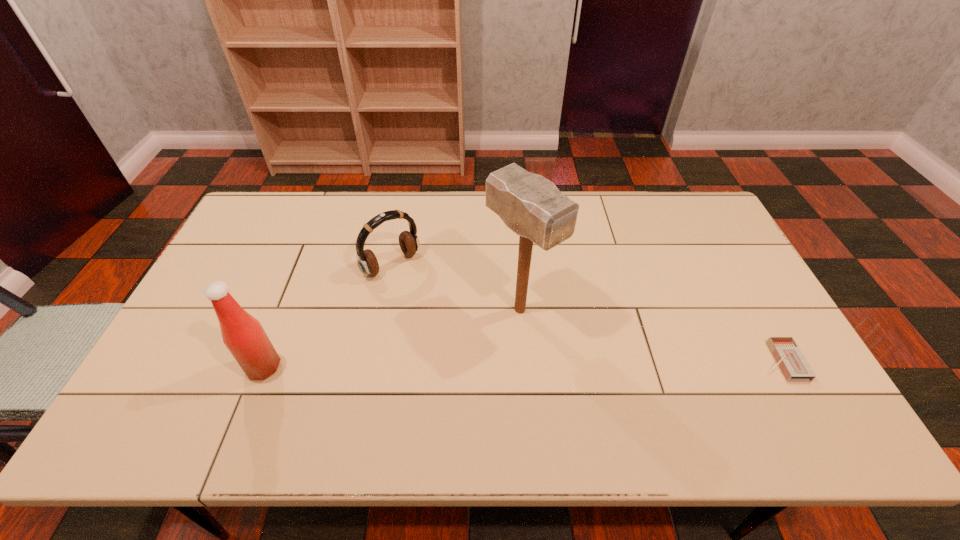
Identify the location of the third shortest object. This screenshot has width=960, height=540. (243, 335).

Locate an element on the screen. Image resolution: width=960 pixels, height=540 pixels. condiment is located at coordinates (243, 335).

Where is `matchbox`? matchbox is located at coordinates (789, 358).

I want to click on the shortest object, so click(789, 358).

Find the location of `the second shortest object`. the second shortest object is located at coordinates (367, 262).

I want to click on the third object from right to left, so click(367, 262).

Locate an element on the screen. the tallest object is located at coordinates (530, 205).

Find the location of a particular element. The height and width of the screenshot is (540, 960). the second object from right to left is located at coordinates (530, 205).

The width and height of the screenshot is (960, 540). I want to click on vacant space located on the front-facing side of the condiment, so click(x=223, y=367).

Find the location of `vacant space positioned on the front-facing side of the condiment`. vacant space positioned on the front-facing side of the condiment is located at coordinates point(167,367).